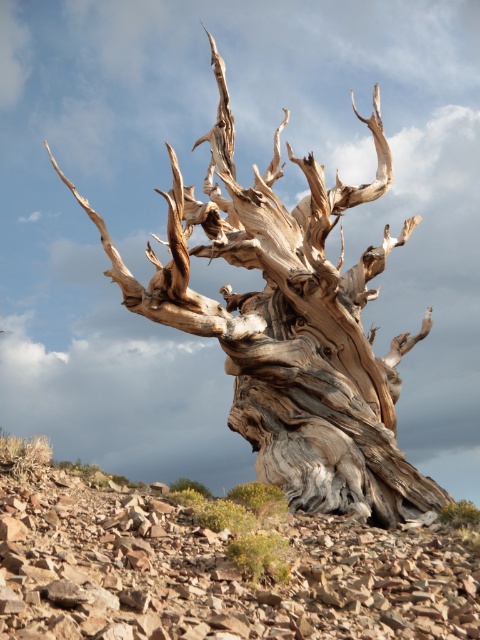
You are standing in front of the ancient bristlecone pine tree. There is a gray textured wood at center marked by point (290, 324). Can you tell me the coordinates of the gray textured wood at center?

The gray textured wood at center is represented by point (290, 324).